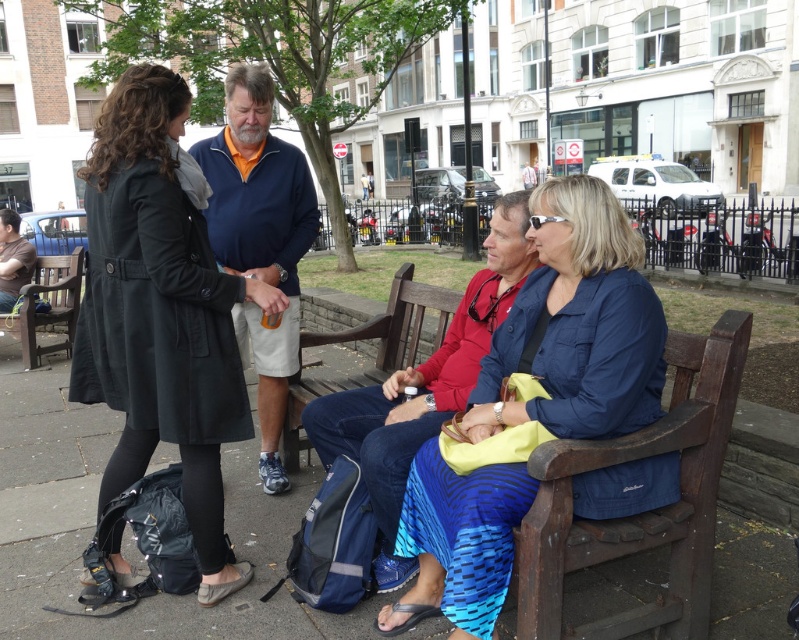
Where is the black matte coat at left located in the image?

The black matte coat at left is located at point (161, 310) in the image.

You are a photographer planning to take a photo of the blue fleece at center and the brown wooden bench at center. Which object should you focus on first if you want to capture both in the same frame without moving the camera?

The blue fleece at center is taller than the brown wooden bench at center, so you should focus on the blue fleece at center first to ensure it fits within the frame.

You are a photographer standing at the center of the park, and you want to take a photo of the black matte coat at left and the dark brown wooden bench at left. Can you fit both objects in your camera frame if your camera has a maximum horizontal field of view of 5 meters?

The black matte coat at left and dark brown wooden bench at left are 4.49 meters apart, so yes, you can fit both objects in your camera frame since the distance between them is less than the camera field of view of 5 meters.